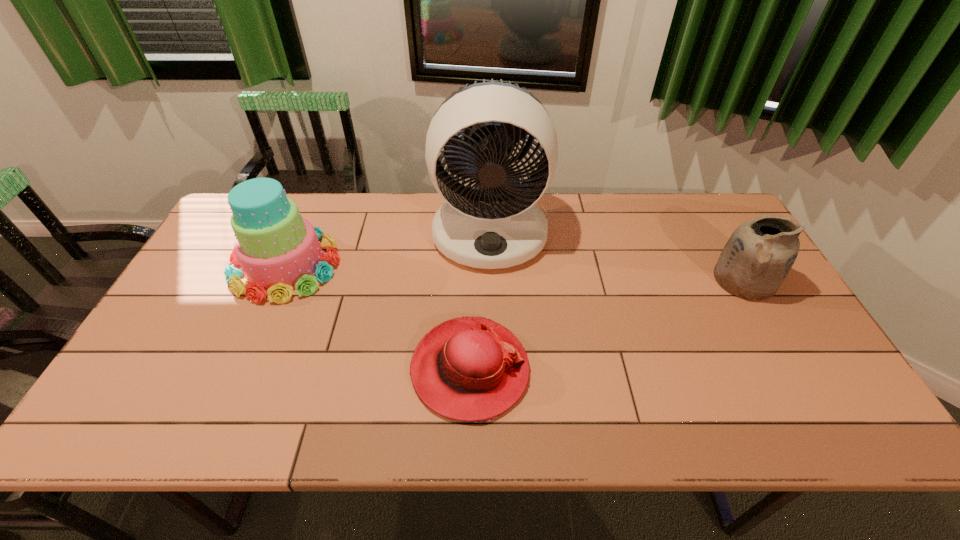
I want to click on vacant space in between the fan and the cake, so click(388, 249).

At what (x,y) coordinates should I click in order to perform the action: click on empty space that is in between the rightmost object and the shortest object. Please return your answer as a coordinate pair (x, y). Looking at the image, I should click on (607, 325).

This screenshot has height=540, width=960. What are the coordinates of `object that is the closest to the fan` in the screenshot? It's located at (472, 369).

Image resolution: width=960 pixels, height=540 pixels. What are the coordinates of `the closest object to the hat` in the screenshot? It's located at (497, 224).

Image resolution: width=960 pixels, height=540 pixels. I want to click on vacant area in the image that satisfies the following two spatial constraints: 1. on the grille of the second shortest object; 2. on the left side of the tallest object, so click(x=491, y=280).

In order to click on free space that satisfies the following two spatial constraints: 1. on the grille of the tallest object; 2. at the front of the shortest object with a bow in this screenshot , I will do `click(493, 369)`.

Where is `vacant area that satisfies the following two spatial constraints: 1. on the grille of the second shortest object; 2. on the left side of the tallest object`? vacant area that satisfies the following two spatial constraints: 1. on the grille of the second shortest object; 2. on the left side of the tallest object is located at coordinates (491, 280).